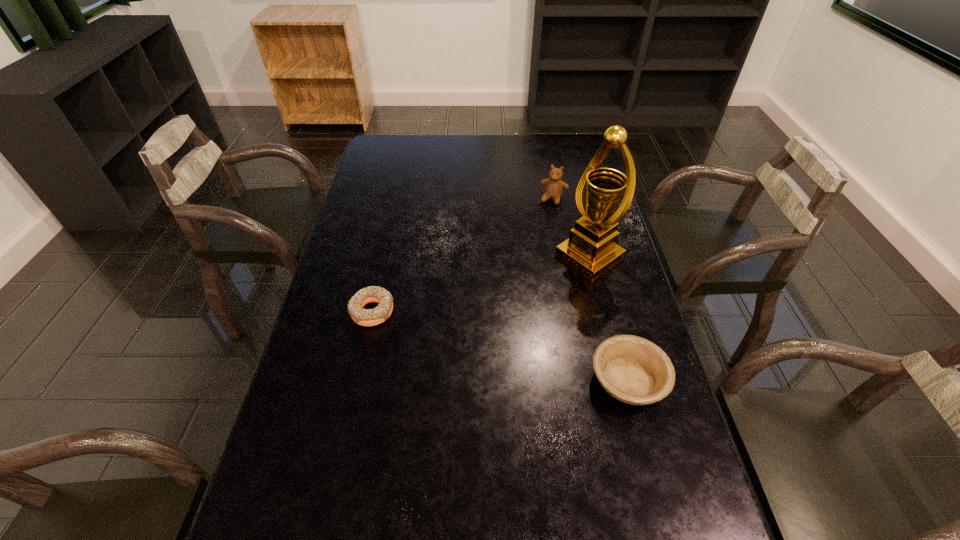
What are the coordinates of `the leftmost object` in the screenshot? It's located at (365, 317).

The height and width of the screenshot is (540, 960). Identify the location of the shortest object. (365, 317).

Locate an element on the screen. The height and width of the screenshot is (540, 960). the nearest object is located at coordinates [634, 370].

You are a GUI agent. You are given a task and a screenshot of the screen. Output one action in this format:
    pyautogui.click(x=<x>, y=<y>)
    Task: Click on the third tallest object
    
    Given the screenshot: What is the action you would take?
    pyautogui.click(x=634, y=370)

The height and width of the screenshot is (540, 960). Identify the location of the farthest object. (554, 186).

Where is `teddy bear`? teddy bear is located at coordinates (554, 186).

Image resolution: width=960 pixels, height=540 pixels. Find the location of `award`. award is located at coordinates (591, 248).

This screenshot has width=960, height=540. I want to click on the tallest object, so click(591, 248).

Find the location of `blank area located on the front of the shortest object`. blank area located on the front of the shortest object is located at coordinates (357, 381).

This screenshot has height=540, width=960. I want to click on free space located 0.080m on the back of the nearest object, so click(612, 324).